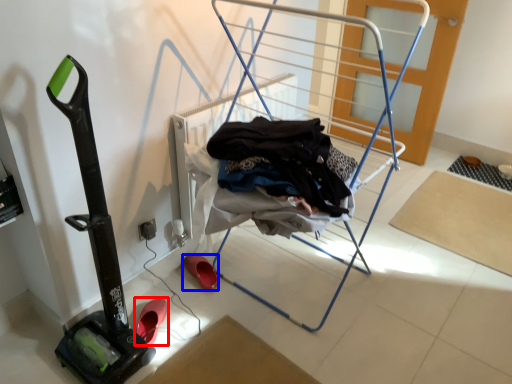
Question: Which of the following is the closest to the observer, footwear (highlighted by a red box) or footwear (highlighted by a blue box)?

Choices:
 (A) footwear
 (B) footwear

Answer: (A)